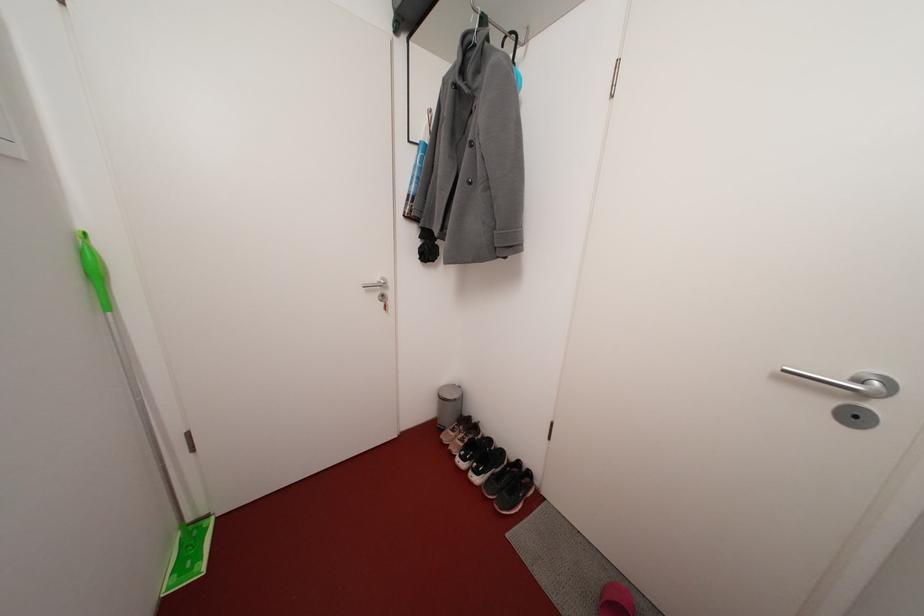
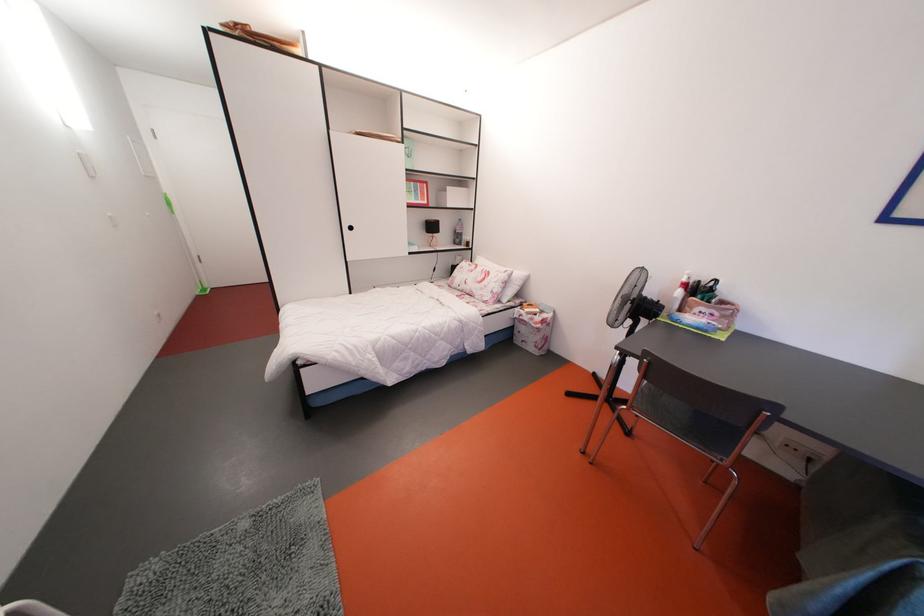
The images are taken continuously from a first-person perspective. In which direction are you moving?

The movement direction of the cameraman is right, backward.